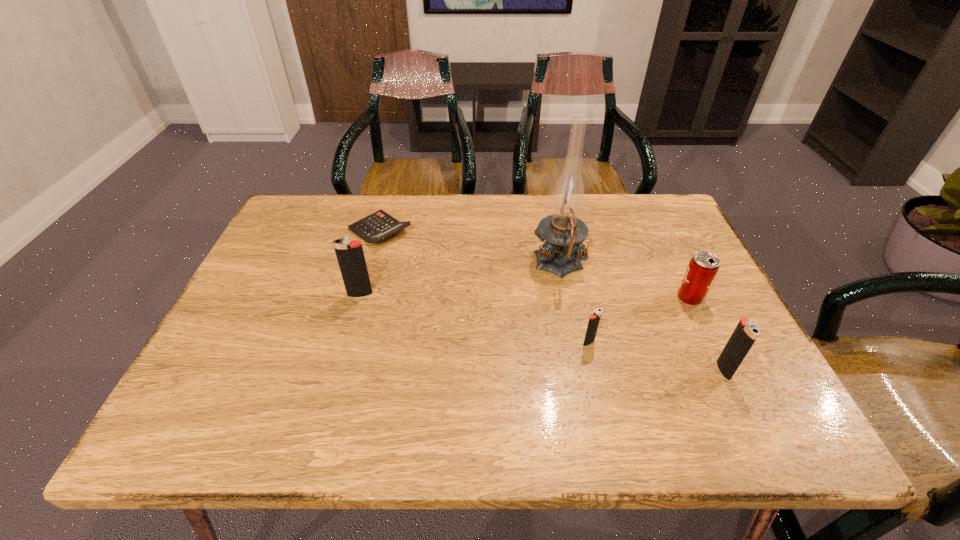
At what (x,y) coordinates should I click in order to perform the action: click on vacant space situated 0.290m on the back of the nearest igniter. Please return your answer as a coordinate pair (x, y). The image size is (960, 540). Looking at the image, I should click on click(x=675, y=268).

The height and width of the screenshot is (540, 960). Identify the location of vacant point located on the front of the fourth tallest object. (739, 400).

At what (x,y) coordinates should I click in order to perform the action: click on vacant space located 0.170m on the left of the calculator. Please return your answer as a coordinate pair (x, y). Looking at the image, I should click on tap(288, 231).

The image size is (960, 540). Find the location of `blank area located on the left of the oil lamp`. blank area located on the left of the oil lamp is located at coordinates (390, 265).

Identify the location of object present at the far edge. Image resolution: width=960 pixels, height=540 pixels. (378, 226).

The image size is (960, 540). Find the location of `object at the near edge`. object at the near edge is located at coordinates (746, 332).

Where is `igniter present at the right edge`? The width and height of the screenshot is (960, 540). igniter present at the right edge is located at coordinates (746, 332).

Where is `beer can that is at the right edge`? Image resolution: width=960 pixels, height=540 pixels. beer can that is at the right edge is located at coordinates (702, 269).

The width and height of the screenshot is (960, 540). What are the coordinates of `object that is at the near right corner` in the screenshot? It's located at [x=746, y=332].

In the image, there is a desktop. Identify the location of free space at the far edge. (610, 212).